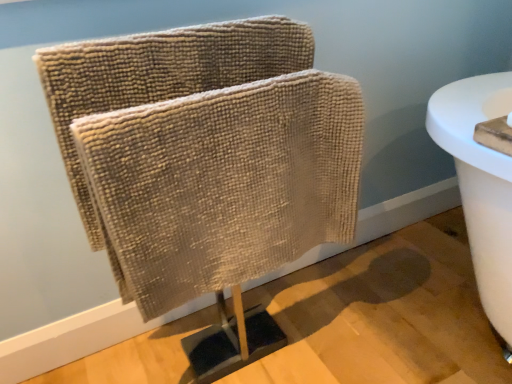
Question: Should I look upward or downward to see beige textured towel at center?

Choices:
 (A) down
 (B) up

Answer: (A)